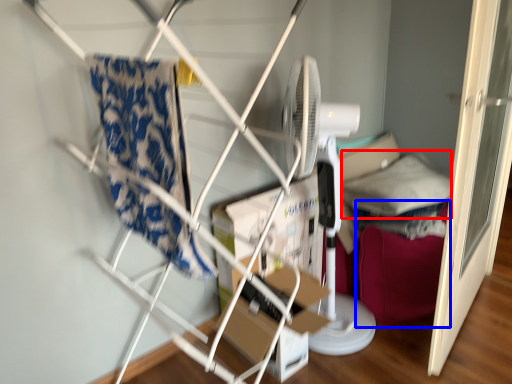
Question: Which point is closer to the camera, pillow (highlighted by a red box) or bean bag chair (highlighted by a blue box)?

Choices:
 (A) pillow
 (B) bean bag chair

Answer: (B)